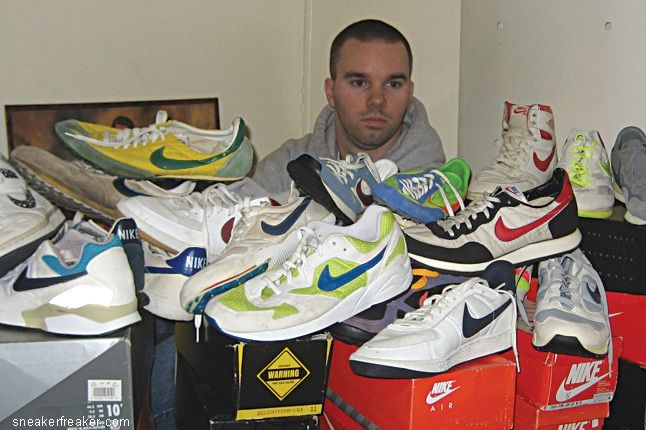
Find the location of `shoe box`. shoe box is located at coordinates (74, 383), (280, 383), (432, 396), (578, 384), (595, 426), (625, 327), (335, 420).